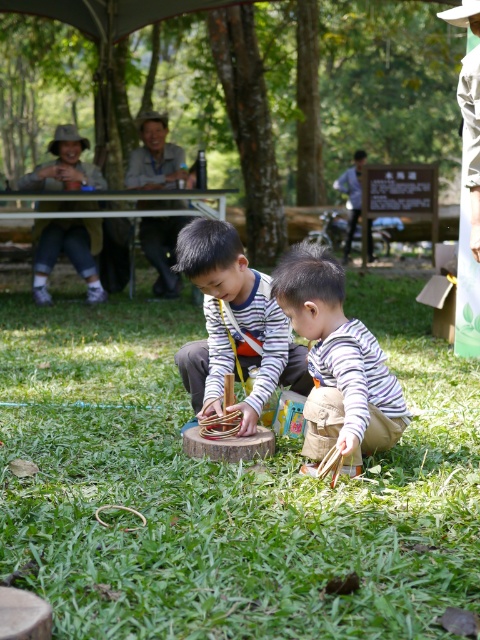
Who is shorter, green grass at center or striped fabric child at center?

Standing shorter between the two is green grass at center.

Describe the element at coordinates (226, 484) in the screenshot. I see `green grass at center` at that location.

The height and width of the screenshot is (640, 480). What are the coordinates of `green grass at center` in the screenshot? It's located at (226, 484).

Which is in front, point (275, 273) or point (204, 307)?

Positioned in front is point (275, 273).

Is point (360, 323) behind point (240, 244)?

No.

The image size is (480, 640). What do you see at coordinates (337, 362) in the screenshot?
I see `striped fabric child at center` at bounding box center [337, 362].

You are a GUI agent. You are given a task and a screenshot of the screen. Output one action in this format:
    pyautogui.click(x=<x>, y=<y>)
    Task: Click on the striped fabric child at center
    This screenshot has height=640, width=480.
    Given the screenshot: What is the action you would take?
    pyautogui.click(x=337, y=362)

Is green grass at center further to camera compared to striped fabric boy at center?

That is False.

Between green grass at center and striped fabric boy at center, which one has less height?

green grass at center is shorter.

Who is more distant from viewer, [158,630] or [271,378]?

The point [271,378] is behind.

Identify the location of green grass at center. This screenshot has height=640, width=480. (226, 484).